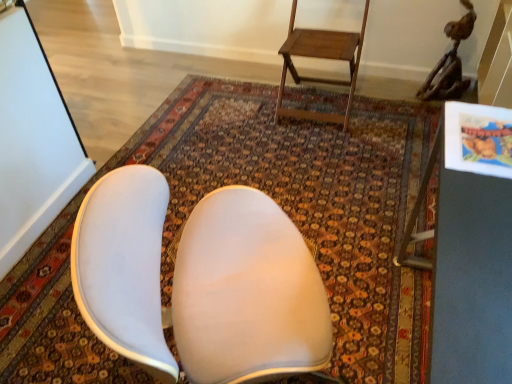
Image resolution: width=512 pixels, height=384 pixels. What are the coordinates of `vacant region under wooden step stool at upper center (from a real-world perspective)` in the screenshot? It's located at (317, 107).